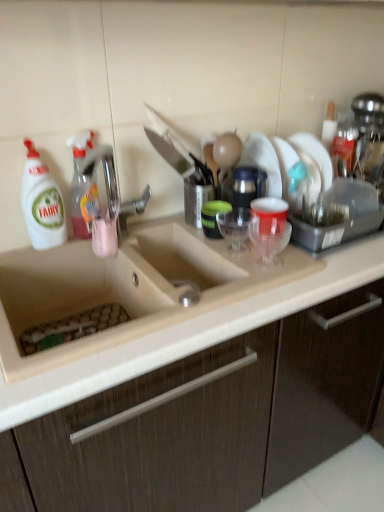
In order to click on vacant area that is in front of translucent plastic cup at sink, positioned as the 2th tableware in right-to-left order in this screenshot , I will do `click(233, 261)`.